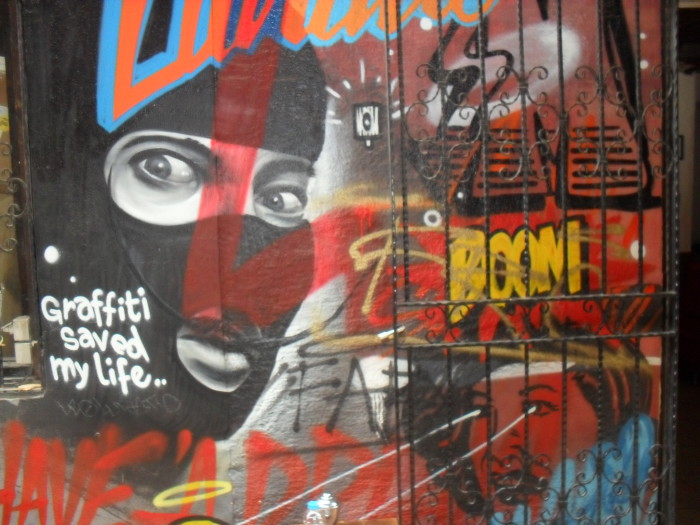
Locate an element on the screen. stair is located at coordinates (519, 182).